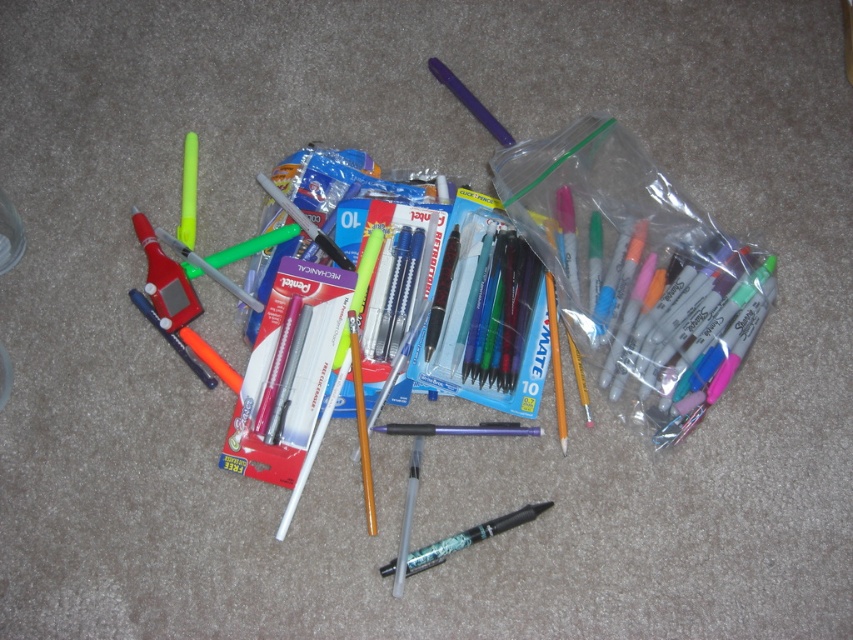
Question: Which point is closer to the camera?

Choices:
 (A) metallic silver pen at center
 (B) metallic green pen at center
 (C) matte plastic pen at center
 (D) matte purple pen at upper center

Answer: (A)

Question: Does matte plastic pen at center appear over translucent plastic highlighter at center-left?

Choices:
 (A) no
 (B) yes

Answer: (A)

Question: Is metallic silver pen at center in front of translucent plastic highlighter at center-left?

Choices:
 (A) yes
 (B) no

Answer: (A)

Question: Estimate the real-world distances between objects in this image. Which object is farther from the translucent plastic highlighter at center-left?

Choices:
 (A) matte purple pen at upper center
 (B) metallic silver pen at center

Answer: (A)

Question: Does metallic green pen at center appear on the left side of translucent plastic highlighter at center-left?

Choices:
 (A) yes
 (B) no

Answer: (B)

Question: Which is farther from the metallic green pen at center?

Choices:
 (A) translucent plastic highlighter at center-left
 (B) matte plastic pen at center

Answer: (A)